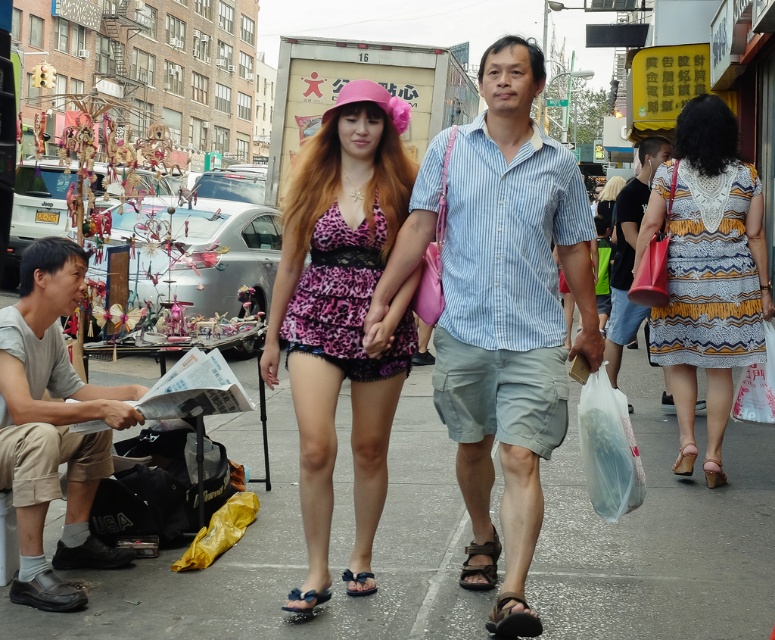
You are a photographer capturing the scene from the street. You notice the leopard print fabric dress at center and the black leather sandal at lower center. Which object is located more to the left side of the image?

The leopard print fabric dress at center is positioned on the left side of black leather sandal at lower center, so it is more to the left.

You are standing at the point with coordinates point (x=687, y=282) and want to walk to the point with coordinates point (x=496, y=353). Which direction should you move in?

You should move forward because point (x=496, y=353) is in front of point (x=687, y=282).

You are a photographer trying to capture a couple walking in the street. You notice the blue striped shirt at center and the printed fabric dress at center. Which clothing item is closer to the camera?

The blue striped shirt at center is positioned under the printed fabric dress at center, so the printed fabric dress at center is closer to the camera.